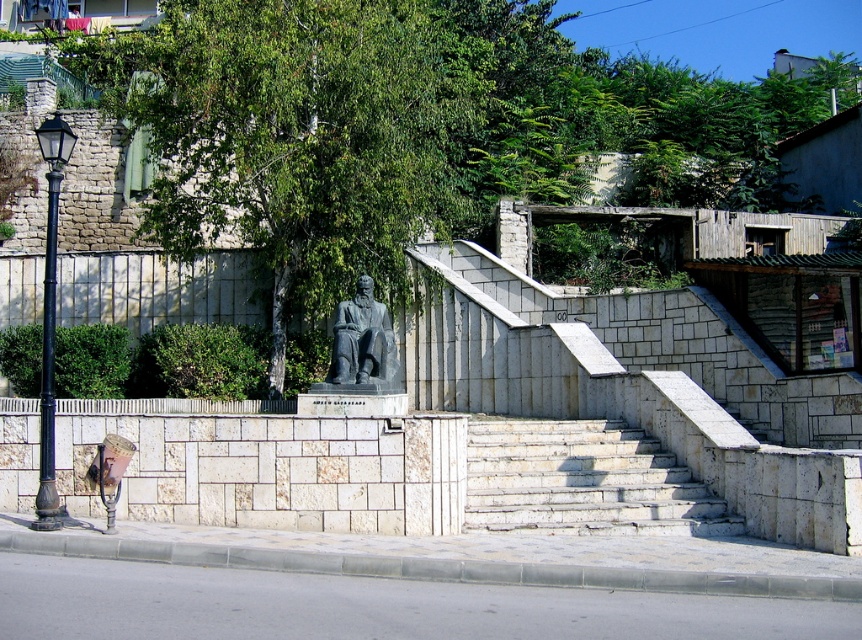
You are standing at the base of the stone staircase in the urban scene. You notice a point marked at coordinates (417, 128). What object is located at that exact point?

At point (417, 128) lies green leafy tree at center.

You are standing at the base of the stone staircase in the urban scene. There is a point marked at coordinates (476, 440) that you need to reach. Considering the layout described, can you estimate how far this point is from your current position?

The point at coordinates (476, 440) is 60.38 feet away from the camera, so it is approximately 60.38 feet away from your current position at the base of the staircase.